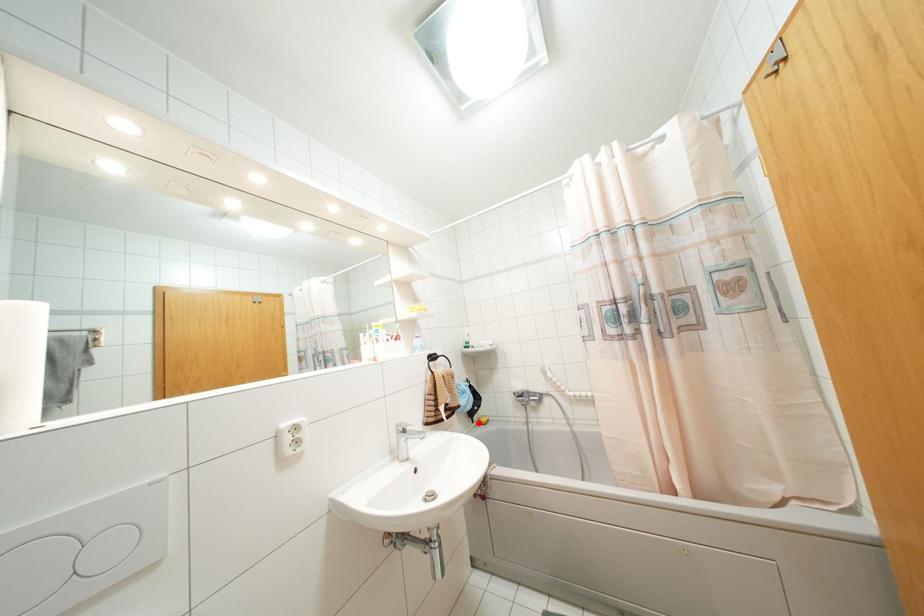
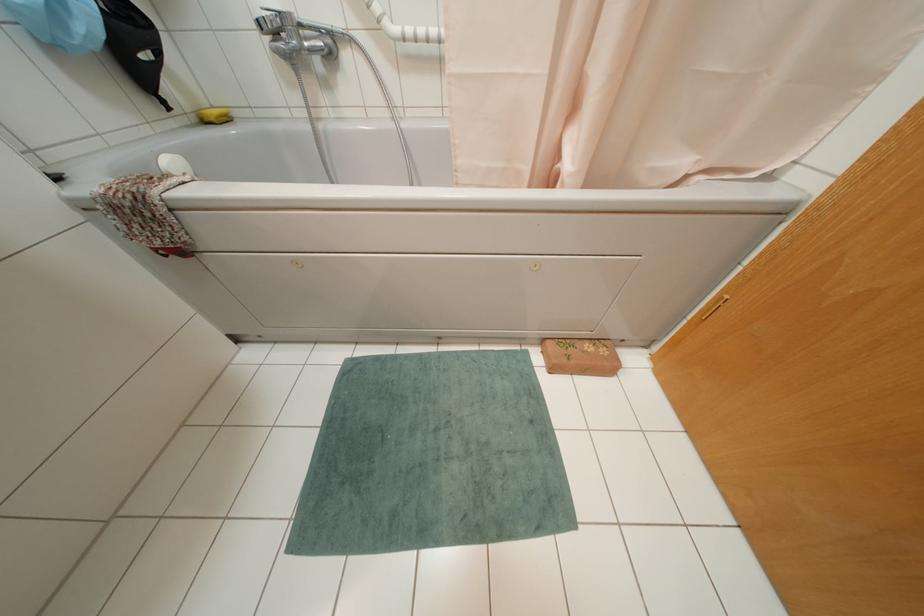
Question: I am providing you with two images of the same scene from different viewpoints. A red point is marked on the first image. Can you still see the location of the red point in image 2?

Choices:
 (A) Yes
 (B) No

Answer: (A)